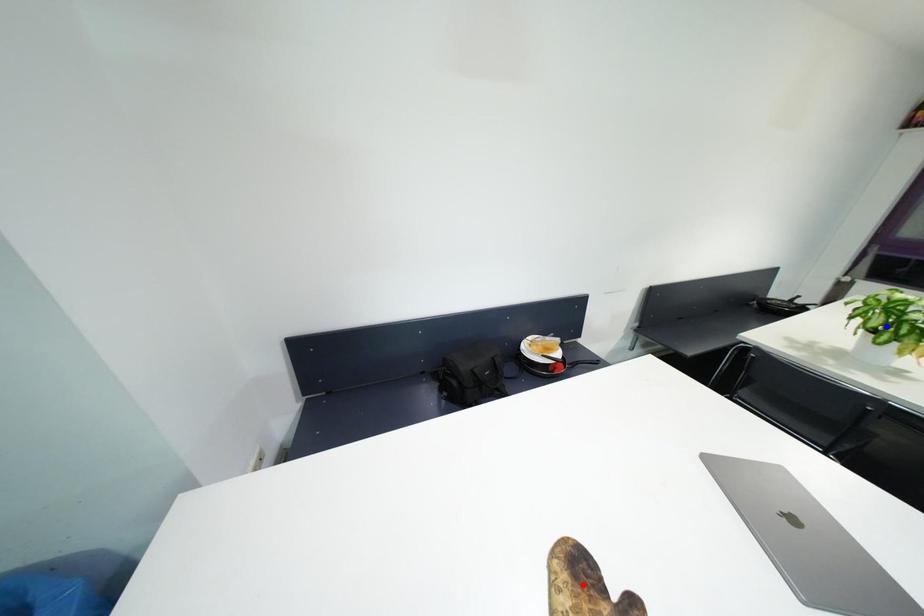
Question: Two points are marked on the image. Which point is closer to the camera?

Choices:
 (A) Blue point is closer.
 (B) Red point is closer.

Answer: (B)